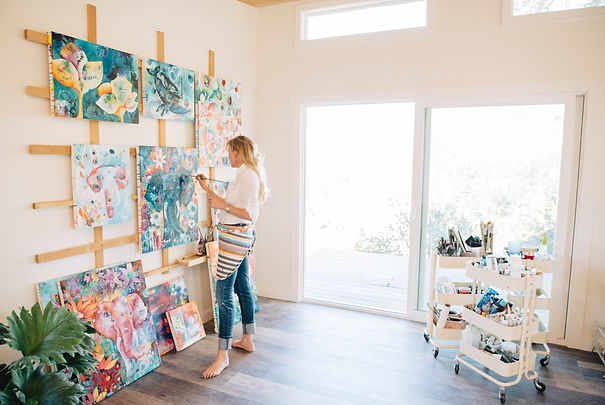
Image resolution: width=605 pixels, height=405 pixels. I want to click on door, so click(x=457, y=169).